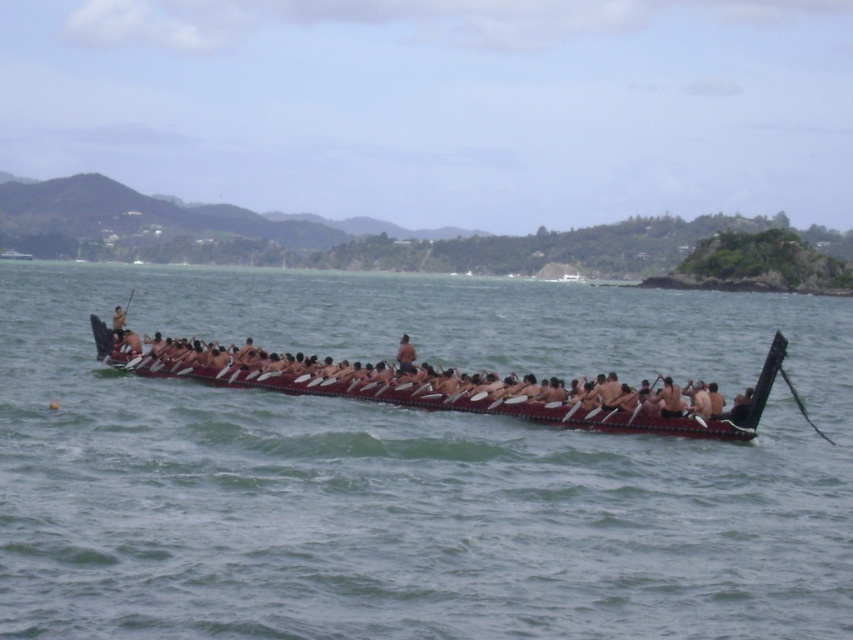
You are standing on the shore observing the canoe and notice two points marked on the image. The first point is at coordinates point (399,401) and the second is at point (579,401). From your perspective, which point is closer to the front of the canoe?

Point (579,401) is closer to the front of the canoe because it is in front of point (399,401), which is behind it.

You are standing on a dock 50 feet away from the brown wooden canoe at center. You want to throw a lifebuoy to the paddlers. Is the distance within your throwing range?

The distance between you and the brown wooden canoe at center is 46.72 feet, which is within your throwing range of 50 feet. You can successfully throw the lifebuoy to the paddlers.